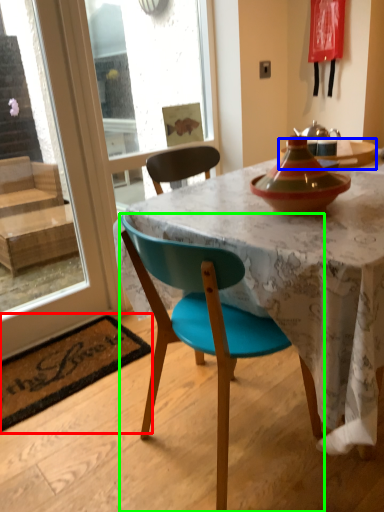
Question: Which is farther away from place mat (highlighted by a red box)? kitchen & dining room table (highlighted by a blue box) or chair (highlighted by a green box)?

Choices:
 (A) kitchen & dining room table
 (B) chair

Answer: (A)